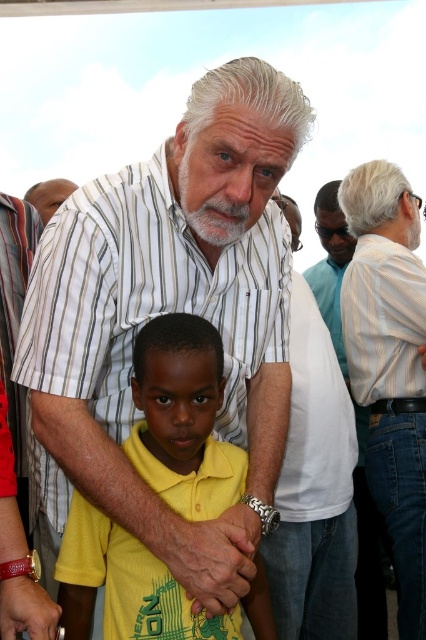
You are standing in the scene and see the point at coordinates (183, 417). Which object is this point located on?

The point at coordinates (183, 417) is located on the yellow matte shirt at center.

Looking at this image, you are standing at the origin point in the image. You see two points labeled as point (x=342, y=314) and point (x=310, y=288). Which point is closer to you?

Point (x=342, y=314) is in front of point (x=310, y=288), so it is closer to you.